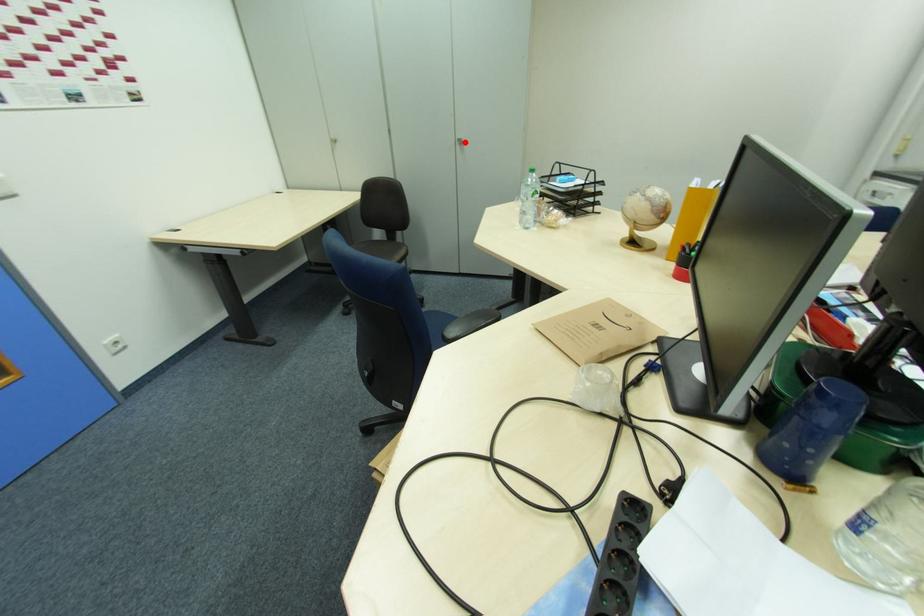
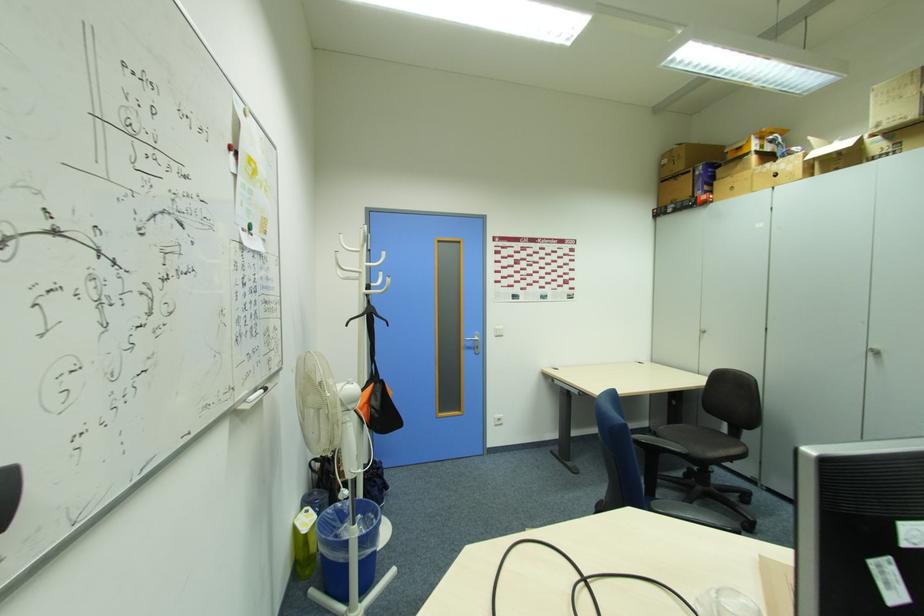
The point at the highlighted location is marked in the first image. Where is the corresponding point in the second image?

(880, 354)